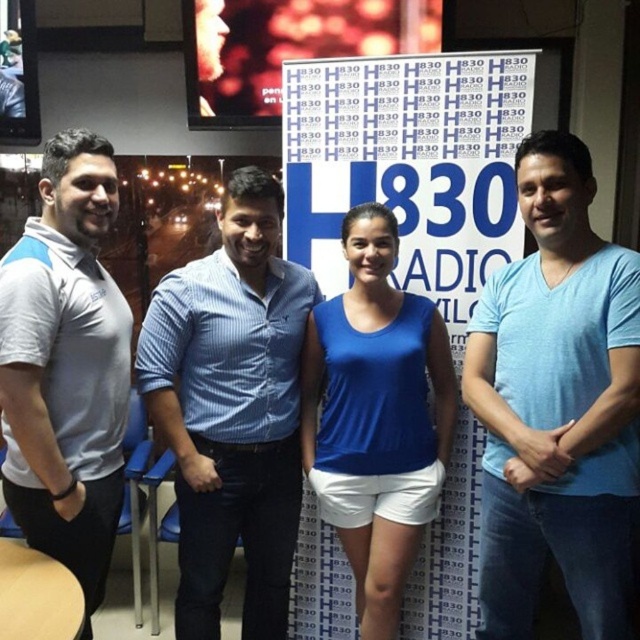
Who is positioned more to the right, gray fabric polo shirt at left or blue fabric tank top at center?

From the viewer's perspective, blue fabric tank top at center appears more on the right side.

Does gray fabric polo shirt at left come in front of blue fabric tank top at center?

Yes, gray fabric polo shirt at left is closer to the viewer.

Which is in front, point (56, 316) or point (440, 392)?

Positioned in front is point (56, 316).

The image size is (640, 640). Find the location of `gray fabric polo shirt at left`. gray fabric polo shirt at left is located at coordinates (65, 365).

Measure the distance from blue striped shirt at center to blue fabric tank top at center.

blue striped shirt at center is 10.86 inches away from blue fabric tank top at center.

Who is shorter, blue striped shirt at center or blue fabric tank top at center?

blue fabric tank top at center

Locate an element on the screen. The image size is (640, 640). blue striped shirt at center is located at coordinates (230, 408).

Is blue fabric sign at center shorter than gray fabric polo shirt at left?

In fact, blue fabric sign at center may be taller than gray fabric polo shirt at left.

This screenshot has width=640, height=640. Describe the element at coordinates (408, 164) in the screenshot. I see `blue fabric sign at center` at that location.

Is point (284, 138) less distant than point (45, 186)?

No, (284, 138) is further to viewer.

I want to click on blue fabric sign at center, so click(408, 164).